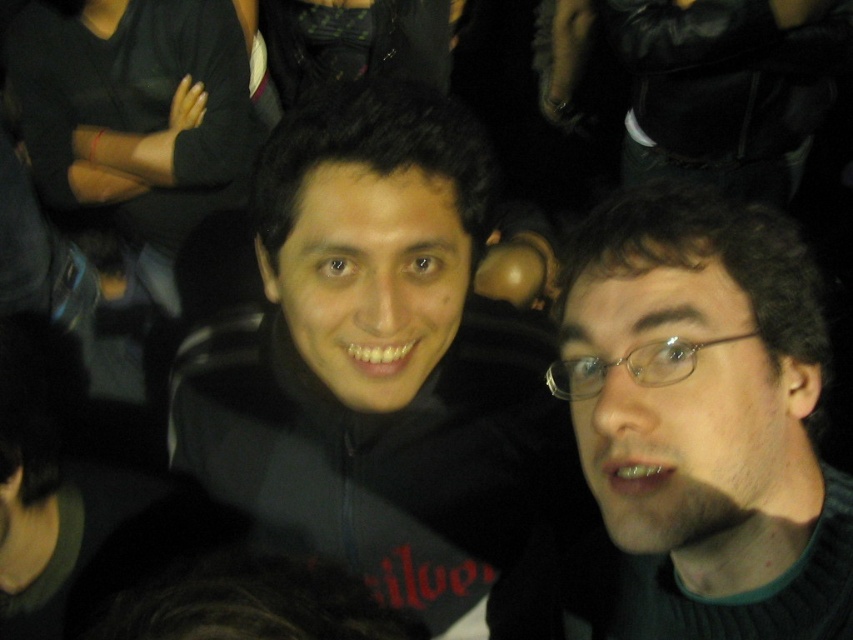
Which is in front, point (344, 131) or point (695, 221)?

Point (695, 221)

Between black matte jacket at center and dark brown hair at right, which one has less height?

dark brown hair at right is shorter.

Is point (451, 378) less distant than point (643, 563)?

No, it is not.

The image size is (853, 640). I want to click on black matte jacket at center, so click(x=380, y=364).